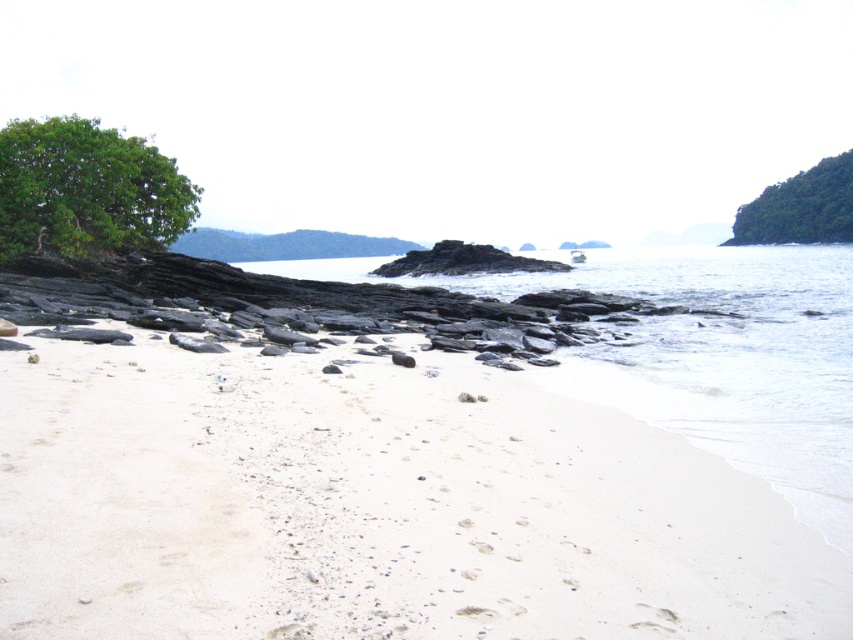
Question: Is white sandy beach at lower left smaller than clear water at center?

Choices:
 (A) no
 (B) yes

Answer: (B)

Question: Which point is closer to the camera?

Choices:
 (A) green leafy tree at upper left
 (B) white sandy beach at lower left
 (C) clear water at center
 (D) green leafy tree at upper right

Answer: (B)

Question: In this image, where is green leafy tree at upper left located relative to green leafy tree at upper right?

Choices:
 (A) below
 (B) above

Answer: (A)

Question: Which object is positioned closest to the green leafy tree at upper left?

Choices:
 (A) green leafy tree at upper right
 (B) white sandy beach at lower left

Answer: (B)

Question: Considering the relative positions of clear water at center and green leafy tree at upper left in the image provided, where is clear water at center located with respect to green leafy tree at upper left?

Choices:
 (A) right
 (B) left

Answer: (A)

Question: Among these objects, which one is nearest to the camera?

Choices:
 (A) white sandy beach at lower left
 (B) green leafy tree at upper left

Answer: (A)